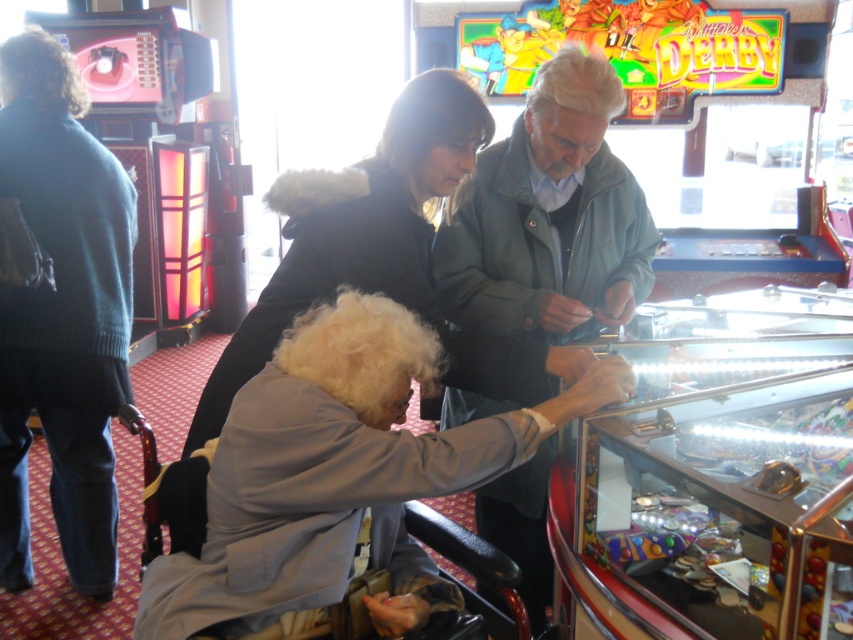
Question: Does dark blue sweater at left have a greater width compared to gray-green leather jacket at center?

Choices:
 (A) yes
 (B) no

Answer: (B)

Question: Can you confirm if dark blue sweater at left is bigger than gray-green leather jacket at center?

Choices:
 (A) no
 (B) yes

Answer: (B)

Question: Which point is farther to the camera?

Choices:
 (A) (198, 604)
 (B) (589, 268)

Answer: (B)

Question: Which point is closer to the camera?

Choices:
 (A) gray fabric jacket at center
 (B) dark blue sweater at left
 (C) gray-green leather jacket at center

Answer: (A)

Question: Estimate the real-world distances between objects in this image. Which object is farther from the gray-green leather jacket at center?

Choices:
 (A) dark blue sweater at left
 (B) gray fabric jacket at center

Answer: (A)

Question: Can you confirm if gray fabric jacket at center is positioned above dark blue sweater at left?

Choices:
 (A) yes
 (B) no

Answer: (B)